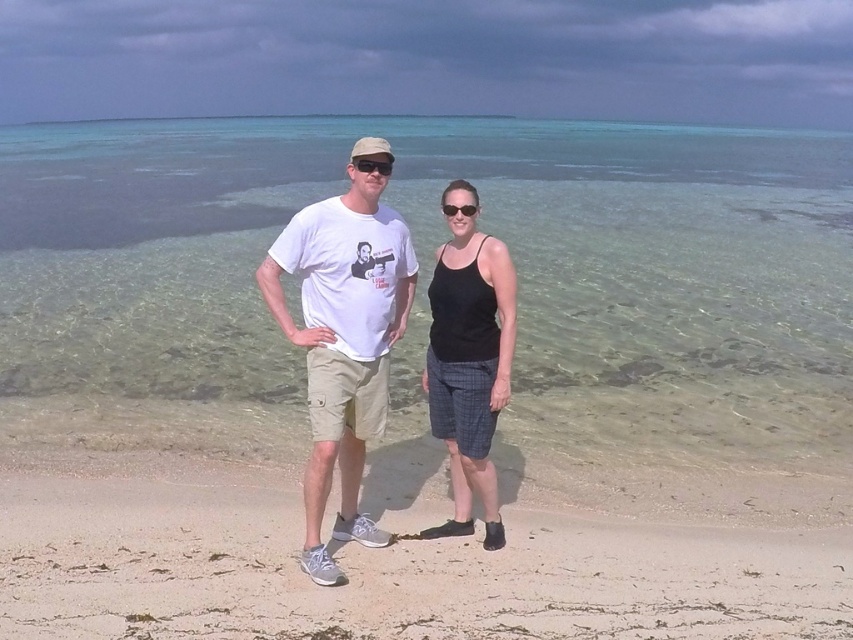
You are a photographer trying to capture a closeup of the light beige sand at center without the black plastic sunglasses at center blocking the view. Based on their positions, is this possible?

The light beige sand at center is in front of the black plastic sunglasses at center, so the sunglasses are behind the sand from the photographer perspective. Therefore, the photographer can take a closeup of the light beige sand at center without the sunglasses blocking the view.